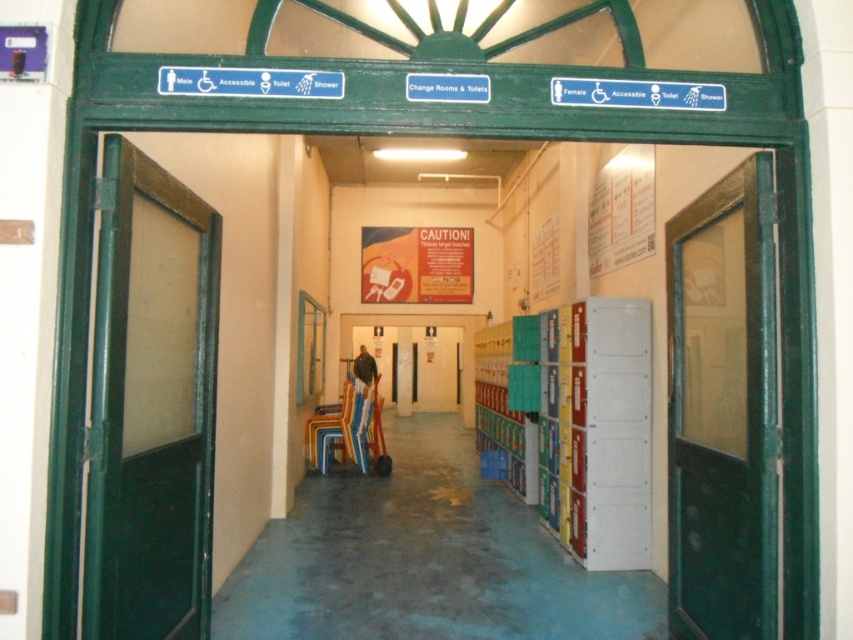
Is point (668, 616) farther from camera compared to point (366, 355)?

No, (668, 616) is closer to viewer.

Which is more to the right, green glass door at center or dark gray jacket at center?

From the viewer's perspective, green glass door at center appears more on the right side.

Which is in front, point (682, 406) or point (364, 376)?

Positioned in front is point (682, 406).

Where is `green glass door at center`? This screenshot has height=640, width=853. green glass door at center is located at coordinates (723, 410).

Does green matte door at left have a lesser height compared to dark gray jacket at center?

No.

What do you see at coordinates (149, 404) in the screenshot? I see `green matte door at left` at bounding box center [149, 404].

Where is `green matte door at left`? The image size is (853, 640). green matte door at left is located at coordinates (149, 404).

Is green matte door at left wider than green glass door at center?

Incorrect, green matte door at left's width does not surpass green glass door at center's.

Consider the image. Is green matte door at left to the left of green glass door at center from the viewer's perspective?

Indeed, green matte door at left is positioned on the left side of green glass door at center.

What do you see at coordinates (149, 404) in the screenshot? The image size is (853, 640). I see `green matte door at left` at bounding box center [149, 404].

Image resolution: width=853 pixels, height=640 pixels. Find the location of `green matte door at left`. green matte door at left is located at coordinates (149, 404).